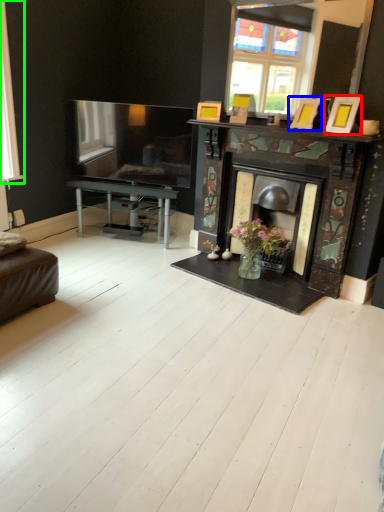
Question: Estimate the real-world distances between objects in this image. Which object is farther from picture frame (highlighted by a red box), picture frame (highlighted by a blue box) or window (highlighted by a green box)?

Choices:
 (A) picture frame
 (B) window

Answer: (B)